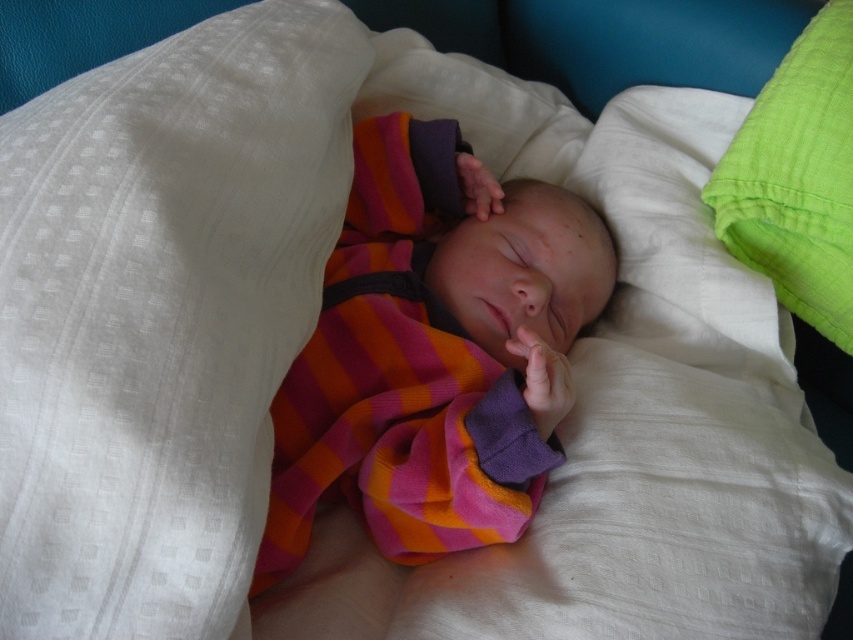
Question: Which of the following is the farthest from the observer?

Choices:
 (A) (68, 310)
 (B) (564, 211)

Answer: (B)

Question: Is white textured pillow at upper left positioned behind striped fleece onesie at center?

Choices:
 (A) yes
 (B) no

Answer: (B)

Question: Among these objects, which one is nearest to the camera?

Choices:
 (A) white textured pillow at upper left
 (B) striped fleece onesie at center
 (C) green cotton pillow at upper right

Answer: (A)

Question: Among these points, which one is nearest to the camera?

Choices:
 (A) (514, 253)
 (B) (817, 244)
 (C) (289, 157)

Answer: (C)

Question: Is white textured pillow at upper left below green cotton pillow at upper right?

Choices:
 (A) no
 (B) yes

Answer: (B)

Question: Is white textured pillow at upper left positioned in front of striped fleece onesie at center?

Choices:
 (A) no
 (B) yes

Answer: (B)